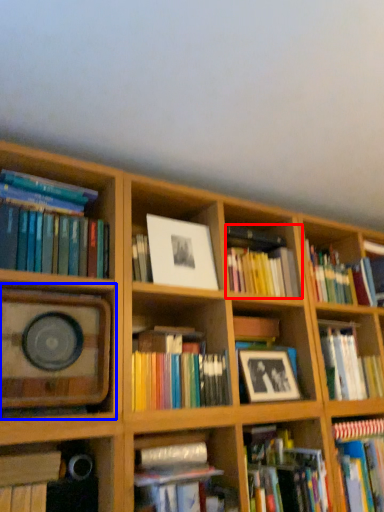
Question: Which point is further to the camera, book (highlighted by a red box) or shelf (highlighted by a blue box)?

Choices:
 (A) book
 (B) shelf

Answer: (A)